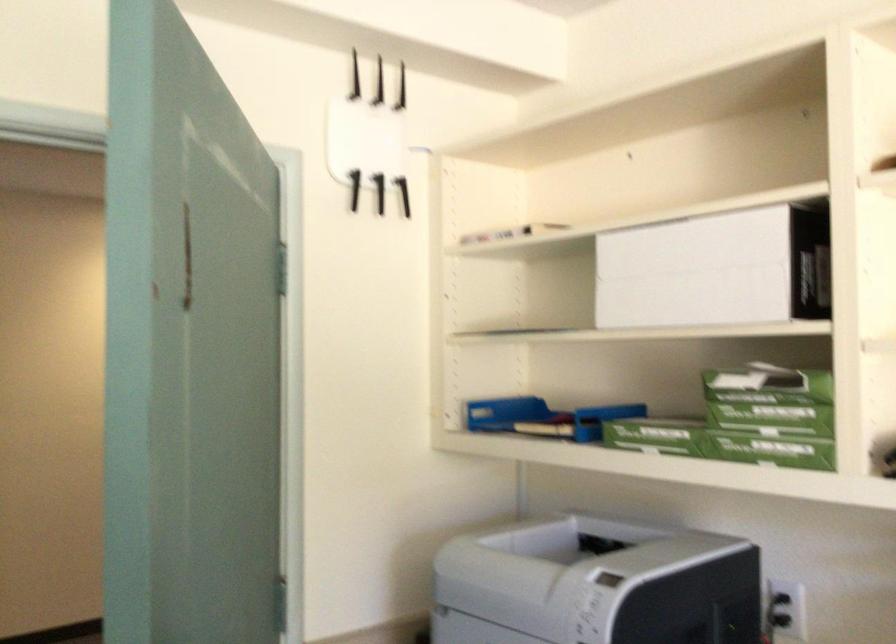
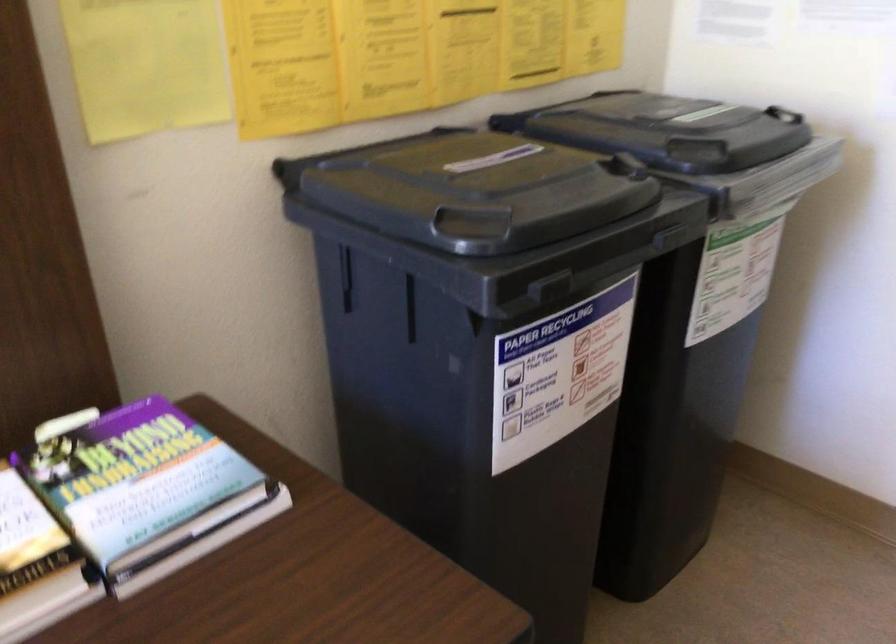
The images are taken continuously from a first-person perspective. In which direction is your viewpoint rotating?

The camera rotated toward left-down.